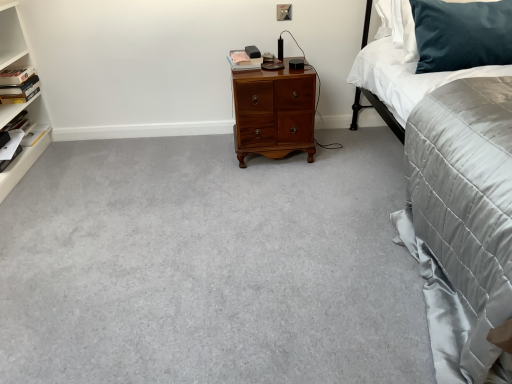
Question: Is dark blue velvet pillow at upper right closer to the viewer compared to white satin sheet at upper right?

Choices:
 (A) no
 (B) yes

Answer: (B)

Question: From the image's perspective, is dark blue velvet pillow at upper right on white satin sheet at upper right?

Choices:
 (A) yes
 (B) no

Answer: (B)

Question: Does dark blue velvet pillow at upper right appear on the right side of white satin sheet at upper right?

Choices:
 (A) no
 (B) yes

Answer: (A)

Question: Is dark blue velvet pillow at upper right outside of white satin sheet at upper right?

Choices:
 (A) no
 (B) yes

Answer: (A)

Question: Is dark blue velvet pillow at upper right touching white satin sheet at upper right?

Choices:
 (A) yes
 (B) no

Answer: (B)

Question: Considering the relative sizes of dark blue velvet pillow at upper right and white satin sheet at upper right in the image provided, is dark blue velvet pillow at upper right smaller than white satin sheet at upper right?

Choices:
 (A) no
 (B) yes

Answer: (B)

Question: Can you confirm if matte pink book at center, marked as the 3th book in a left-to-right arrangement, is taller than hardcover book at left, the third book when ordered from right to left?

Choices:
 (A) yes
 (B) no

Answer: (B)

Question: Is matte pink book at center, which is counted as the 1th book, starting from the top, not within hardcover book at left, the 2th book from the bottom?

Choices:
 (A) yes
 (B) no

Answer: (A)

Question: Is matte pink book at center, placed as the third book when sorted from bottom to top, oriented towards hardcover book at left, the 2th book from the bottom?

Choices:
 (A) yes
 (B) no

Answer: (B)

Question: Is matte pink book at center, marked as the 3th book in a left-to-right arrangement, facing away from hardcover book at left, the 1th book in the left-to-right sequence?

Choices:
 (A) yes
 (B) no

Answer: (B)

Question: Is matte pink book at center, which is counted as the 1th book, starting from the top, directly adjacent to hardcover book at left, marked as the 2th book in a top-to-bottom arrangement?

Choices:
 (A) no
 (B) yes

Answer: (A)

Question: Considering the relative sizes of dark blue velvet pillow at upper right and gray carpet at center in the image provided, is dark blue velvet pillow at upper right taller than gray carpet at center?

Choices:
 (A) yes
 (B) no

Answer: (A)